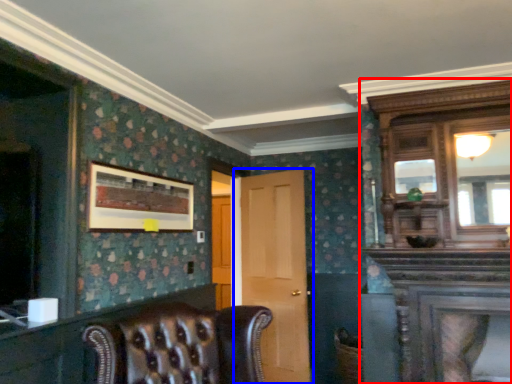
Question: Which object is closer to the camera taking this photo, dresser (highlighted by a red box) or door (highlighted by a blue box)?

Choices:
 (A) dresser
 (B) door

Answer: (A)